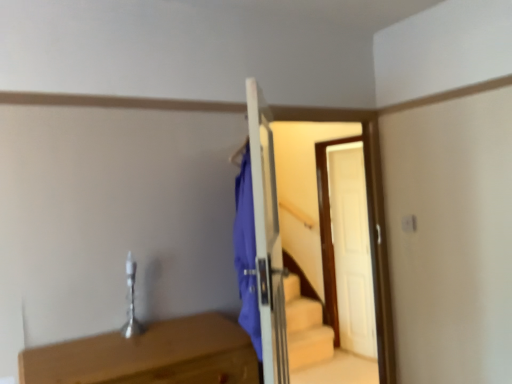
Question: Should I look upward or downward to see white wooden door at center?

Choices:
 (A) down
 (B) up

Answer: (A)

Question: Should I look upward or downward to see light brown wooden table at lower left?

Choices:
 (A) down
 (B) up

Answer: (A)

Question: From the image's perspective, is light brown wooden table at lower left over white wooden door at center?

Choices:
 (A) no
 (B) yes

Answer: (A)

Question: Considering the relative sizes of light brown wooden table at lower left and white wooden door at center in the image provided, is light brown wooden table at lower left bigger than white wooden door at center?

Choices:
 (A) yes
 (B) no

Answer: (B)

Question: Does light brown wooden table at lower left have a lesser height compared to white wooden door at center?

Choices:
 (A) yes
 (B) no

Answer: (A)

Question: From a real-world perspective, is light brown wooden table at lower left under white wooden door at center?

Choices:
 (A) no
 (B) yes

Answer: (B)

Question: Considering the relative sizes of light brown wooden table at lower left and white wooden door at center in the image provided, is light brown wooden table at lower left smaller than white wooden door at center?

Choices:
 (A) yes
 (B) no

Answer: (A)

Question: Is light brown wooden table at lower left aimed at white wooden door at center?

Choices:
 (A) yes
 (B) no

Answer: (B)

Question: Is the depth of white wooden door at center greater than that of light brown wooden table at lower left?

Choices:
 (A) yes
 (B) no

Answer: (A)

Question: From a real-world perspective, does white wooden door at center sit lower than light brown wooden table at lower left?

Choices:
 (A) yes
 (B) no

Answer: (B)

Question: Does white wooden door at center have a lesser height compared to light brown wooden table at lower left?

Choices:
 (A) no
 (B) yes

Answer: (A)

Question: Considering the relative sizes of white wooden door at center and light brown wooden table at lower left in the image provided, is white wooden door at center bigger than light brown wooden table at lower left?

Choices:
 (A) yes
 (B) no

Answer: (A)

Question: Is white wooden door at center not inside light brown wooden table at lower left?

Choices:
 (A) yes
 (B) no

Answer: (A)

Question: From the image's perspective, is white wooden door at center under light brown wooden table at lower left?

Choices:
 (A) yes
 (B) no

Answer: (B)

Question: In the image, is white wooden door at center positioned in front of or behind light brown wooden table at lower left?

Choices:
 (A) front
 (B) behind

Answer: (B)